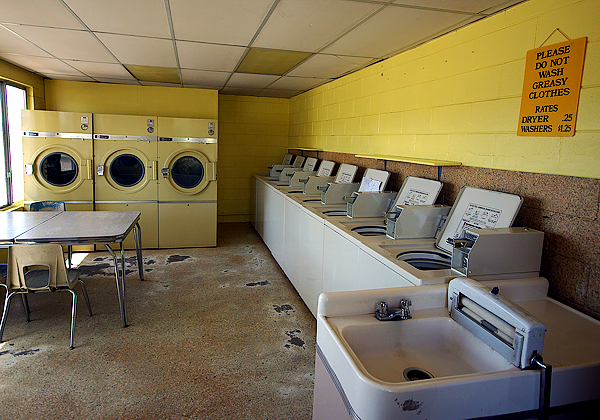
Where is `washer`? The image size is (600, 420). washer is located at coordinates click(x=373, y=264).